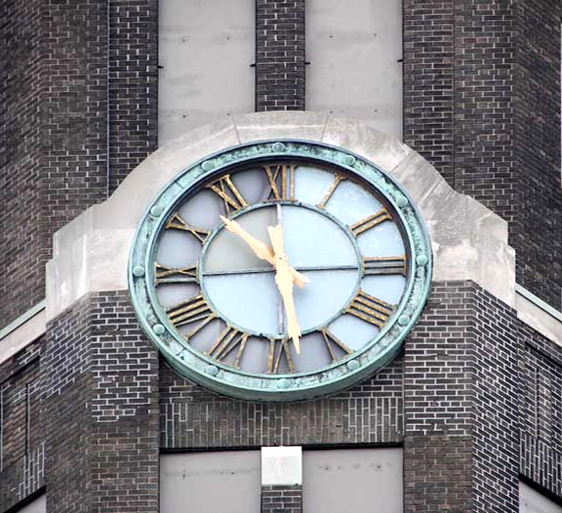
This screenshot has width=562, height=513. I want to click on brick wall, so click(99, 119).